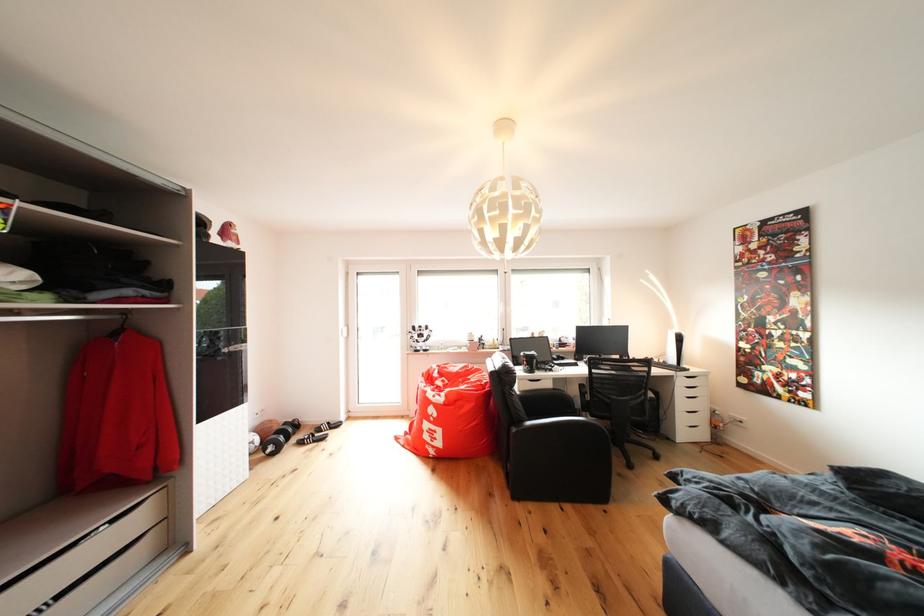
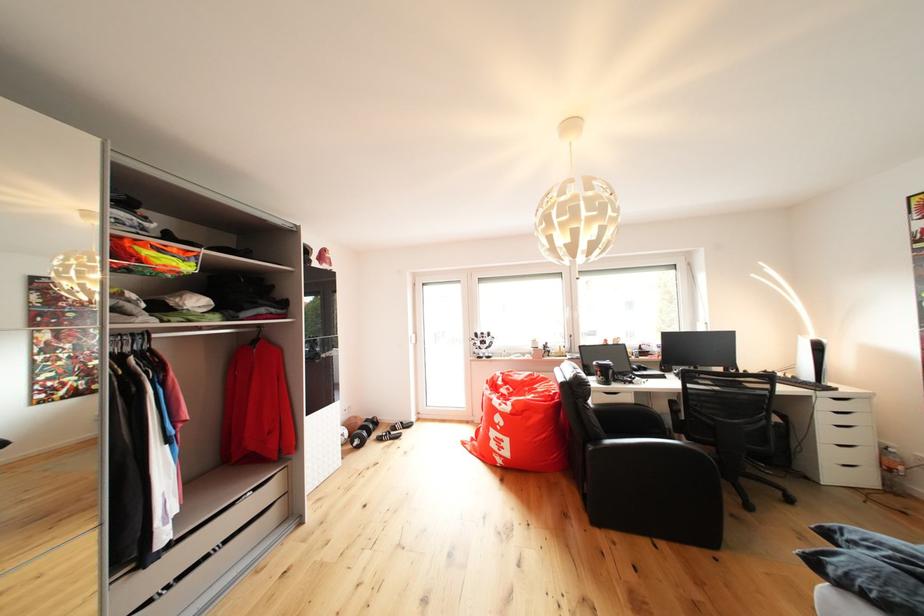
In the second image, find the point that corresponds to point 699,387 in the first image.

(850, 411)